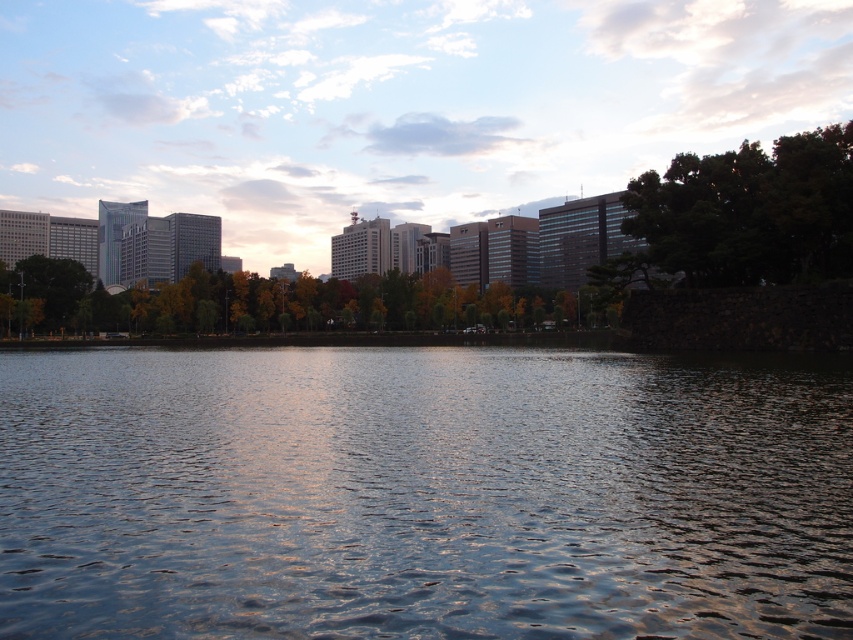
You are standing at the edge of the water in the urban landscape scene. There is a point marked at coordinates (422, 493) which is glistening water at center. Can you see this point from your current position?

Yes, the point marked at coordinates (422, 493) is glistening water at center, which is visible from the edge of the water since it is located at the center of the scene.

You are a photographer standing at the edge of the glistening water at center and want to capture the green leafy tree at upper right in your shot. Considering their positions, will the tree appear behind the water in the photo?

Yes, the glistening water at center is in front of the green leafy tree at upper right, so the tree will appear behind the water in the photo.

You are standing at the center of the image and want to take a photo of the green leafy tree at upper right. Which direction should you face to ensure the tree is in the frame?

The green leafy tree at upper right is located at point coordinates, so you should face towards the upper right direction to capture it in your photo.